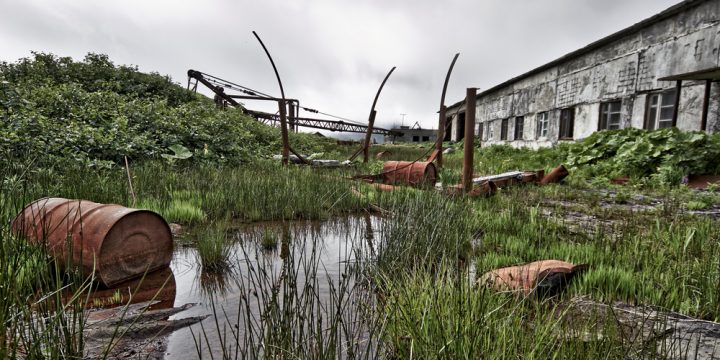
Identify the location of doorway. Image resolution: width=720 pixels, height=360 pixels. (459, 135), (448, 131).